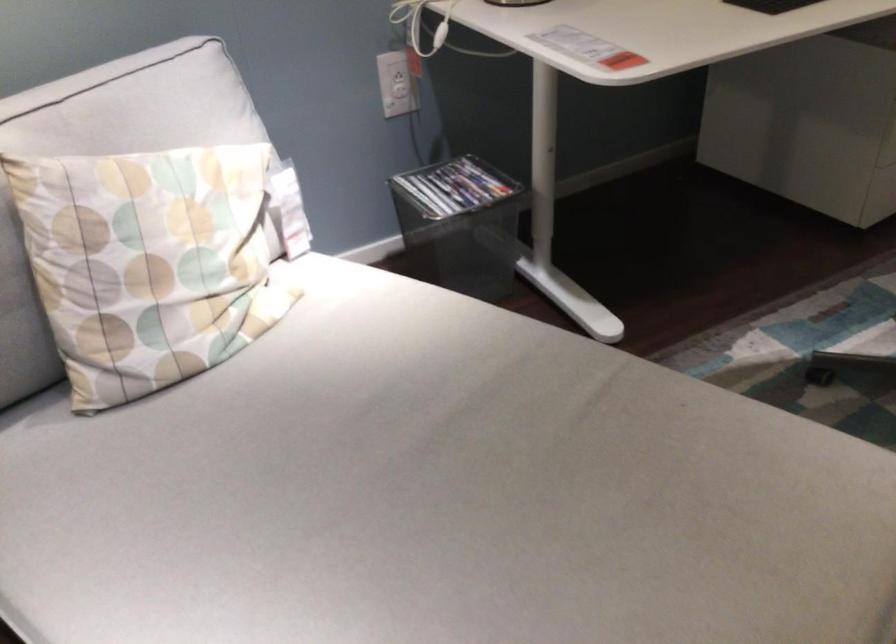
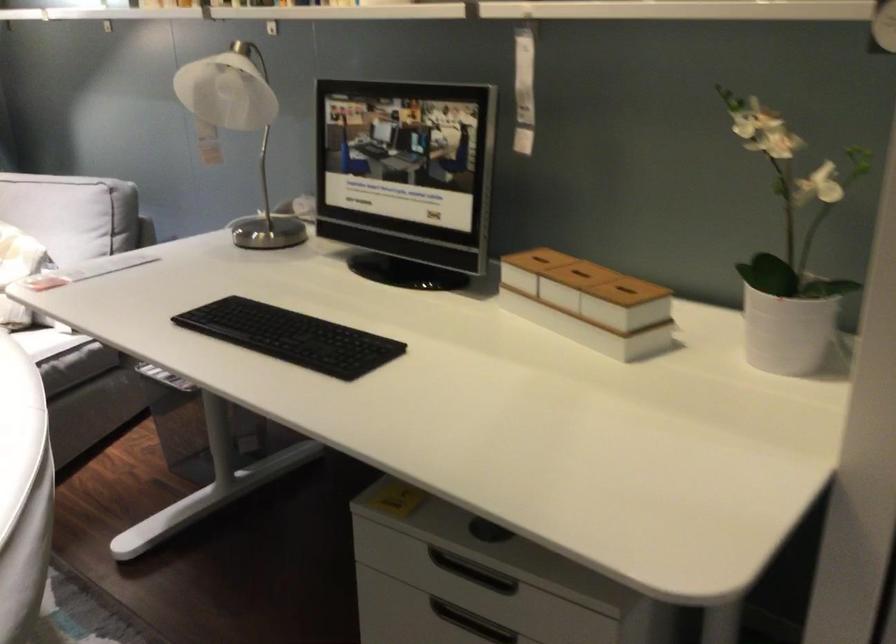
Question: I am providing you with two images of the same scene from different viewpoints. Which of the following objects are not visible in image2?

Choices:
 (A) cabinet drawer handle
 (B) hanging plastic toy
 (C) white plant pot
 (D) white outlet switch

Answer: (D)